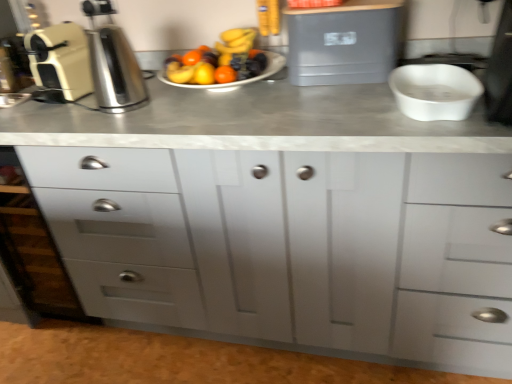
Image resolution: width=512 pixels, height=384 pixels. Identify the location of free space that is in between satin silver coffee machine at left and white glossy mixing bowl at right. (268, 108).